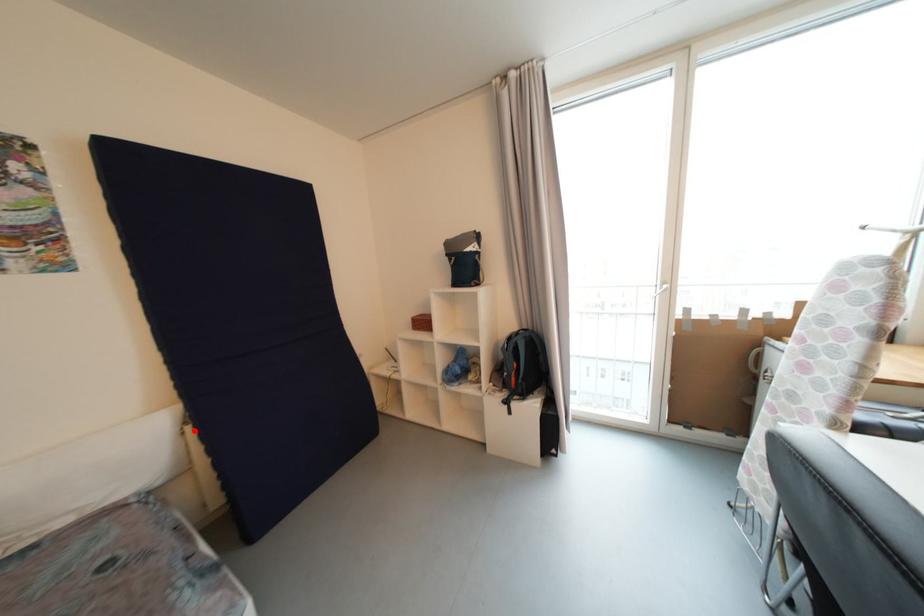
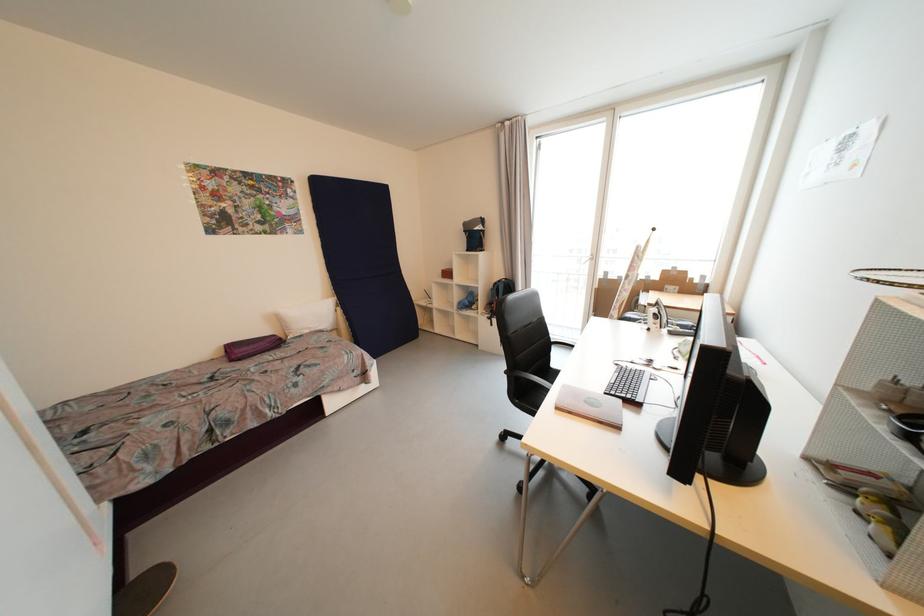
Locate, in the second image, the point that corresponds to the highlighted location in the first image.

(344, 310)